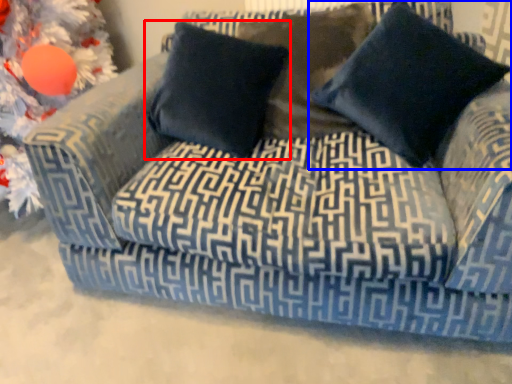
Question: Which object appears farthest to the camera in this image, pillow (highlighted by a red box) or pillow (highlighted by a blue box)?

Choices:
 (A) pillow
 (B) pillow

Answer: (A)